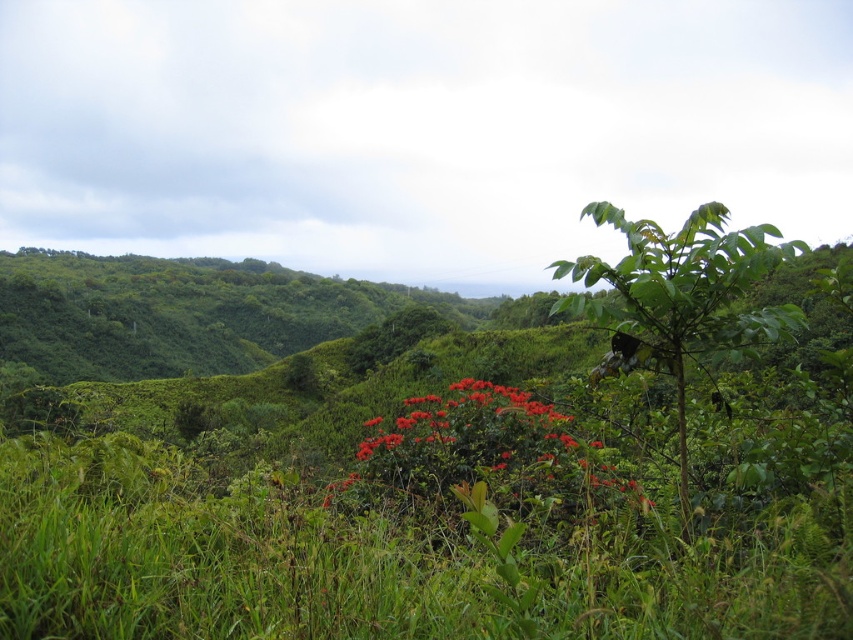
Looking at this image, is green leafy tree at center-right in front of bright red petals at center?

No, it is not.

Is green leafy tree at center-right thinner than bright red petals at center?

In fact, green leafy tree at center-right might be wider than bright red petals at center.

In the scene shown: Who is more forward, (753, 236) or (577, 444)?

Point (753, 236) is in front.

Identify the location of green leafy tree at center-right. The image size is (853, 640). (679, 298).